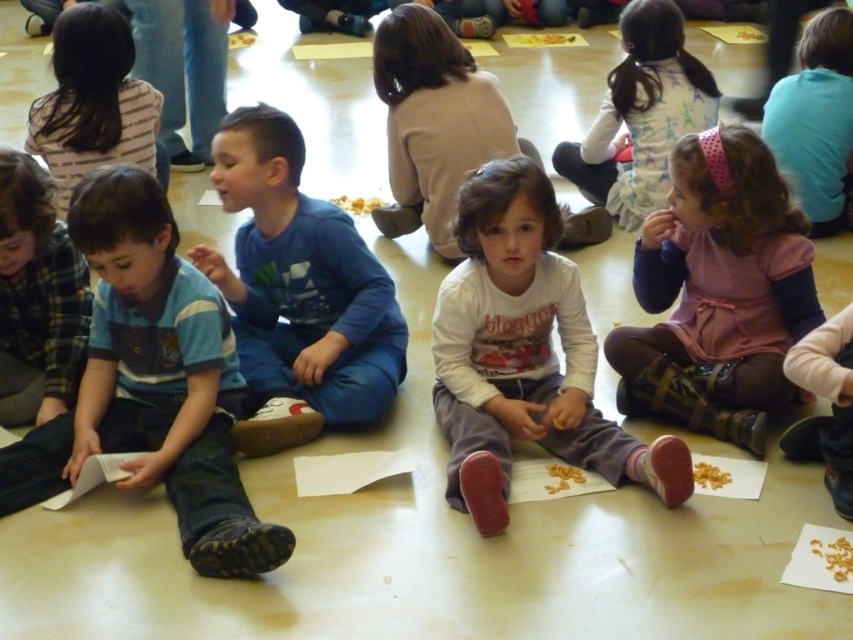
You are a teacher observing the classroom scene. You notice the dark brown hair at upper left and the pink fabric dress at upper right. Which object takes up more space in the image?

The dark brown hair at upper left takes up more space in the image because it has a larger size compared to the pink fabric dress at upper right.

You are a teacher in a classroom and you see the white cotton shirt at center and the white cotton dress at upper center. Which one is positioned more to the left side of the classroom?

The white cotton shirt at center is positioned more to the left side of the classroom than the white cotton dress at upper center.

You are a teacher observing the classroom scene. You notice two children wearing white cotton clothing. The first child is wearing a white cotton shirt at center, and the second is wearing a white cotton dress at upper center. Which child is sitting closer to the front of the classroom?

The white cotton shirt at center is located below the white cotton dress at upper center, so the child wearing the white cotton shirt at center is sitting closer to the front of the classroom.